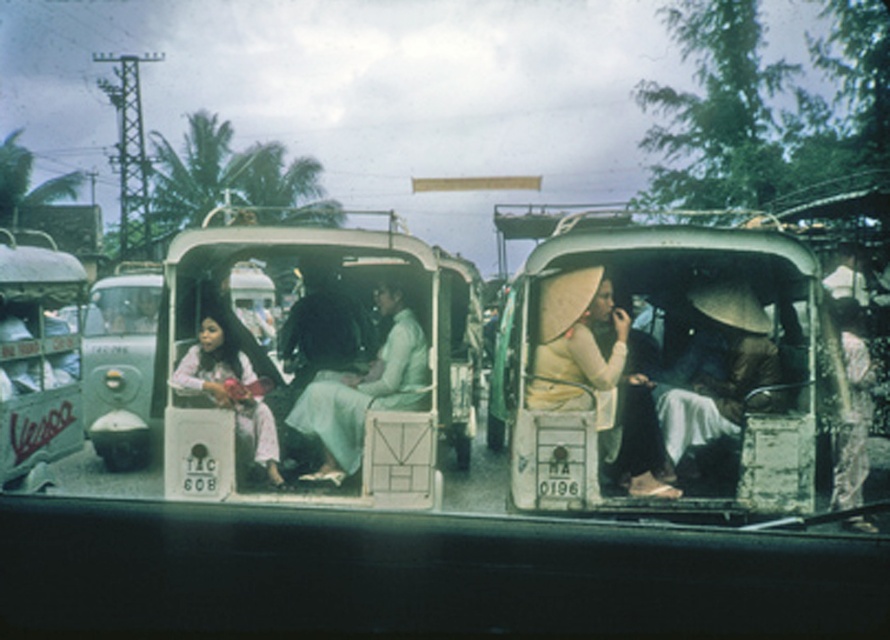
Question: Which of these objects is positioned farthest from the yellow fabric hat at center?

Choices:
 (A) light pink fabric at left
 (B) brushed metal vespa at left

Answer: (B)

Question: Which point is farther to the camera?

Choices:
 (A) (14, 472)
 (B) (207, 390)

Answer: (A)

Question: Is brushed metal vespa at left bigger than light pink fabric at left?

Choices:
 (A) yes
 (B) no

Answer: (A)

Question: Which point is closer to the camera?

Choices:
 (A) yellow fabric hat at center
 (B) brushed metal vespa at left

Answer: (A)

Question: Can you confirm if brushed metal vespa at left is positioned to the left of light pink fabric at left?

Choices:
 (A) no
 (B) yes

Answer: (B)

Question: Is the position of yellow fabric hat at center more distant than that of brushed metal vespa at left?

Choices:
 (A) yes
 (B) no

Answer: (B)